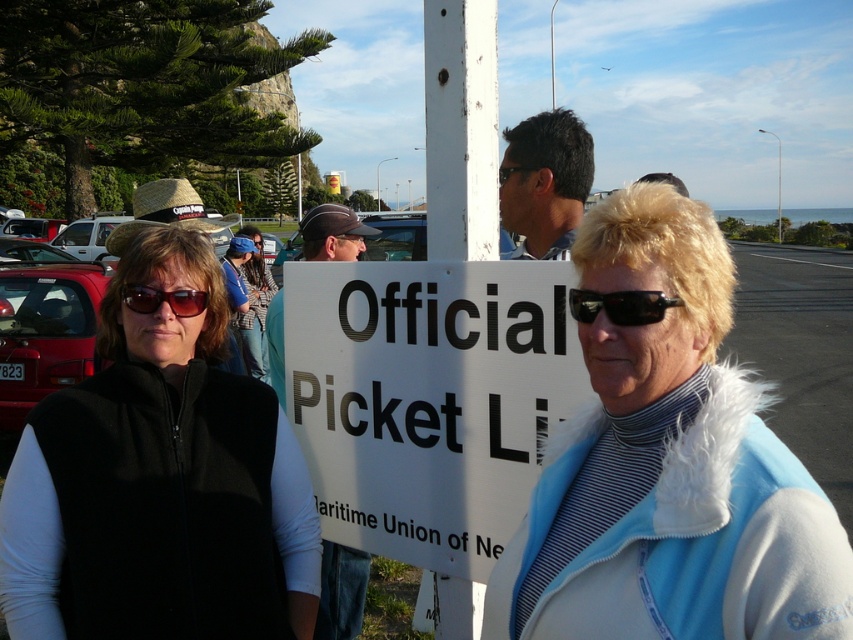
You are a photographer trying to capture a clear shot of the white plastic sign at center without any obstructions. Given that the matte black cap at center is much taller than the sign, what should you do to ensure the sign is visible in the photo?

The matte black cap at center is much taller than the white plastic sign at center, so you should lower your camera angle or move to a lower position to avoid the cap obstructing the view of the sign.